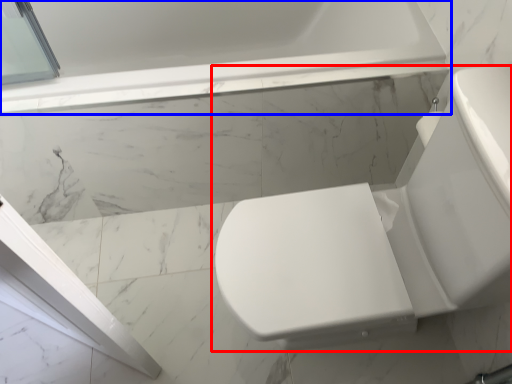
Question: Which object appears closest to the camera in this image, toilet (highlighted by a red box) or bathtub (highlighted by a blue box)?

Choices:
 (A) toilet
 (B) bathtub

Answer: (A)